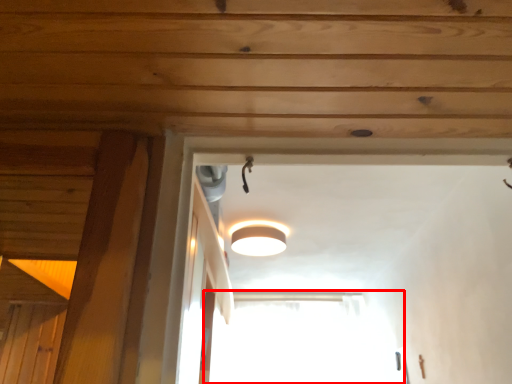
Question: Observing the image, what is the correct spatial positioning of window (annotated by the red box) in reference to lamp?

Choices:
 (A) left
 (B) right

Answer: (B)